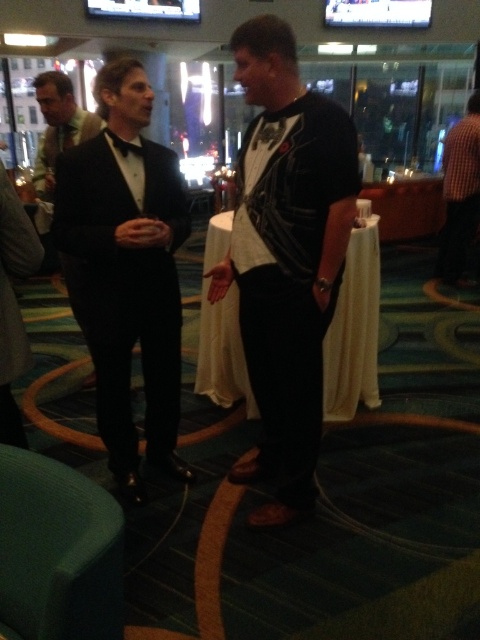
You are standing at the same level as the two men in the image. There are two points marked in the scene. One is at coordinate point [464,140] and the other is at coordinate point [73,116]. Which point is closer to your eyes?

Point [464,140] is further to the camera than point [73,116], so the point closer to your eyes is point [73,116].

You are a photographer at the event and need to capture a photo of both the leather jacket at center and the checkered fabric shirt at right. Based on their positions, which one should you focus on first to ensure both are in frame?

The leather jacket at center is to the left of checkered fabric shirt at right, so you should focus on the checkered fabric shirt at right first to ensure both are in frame.